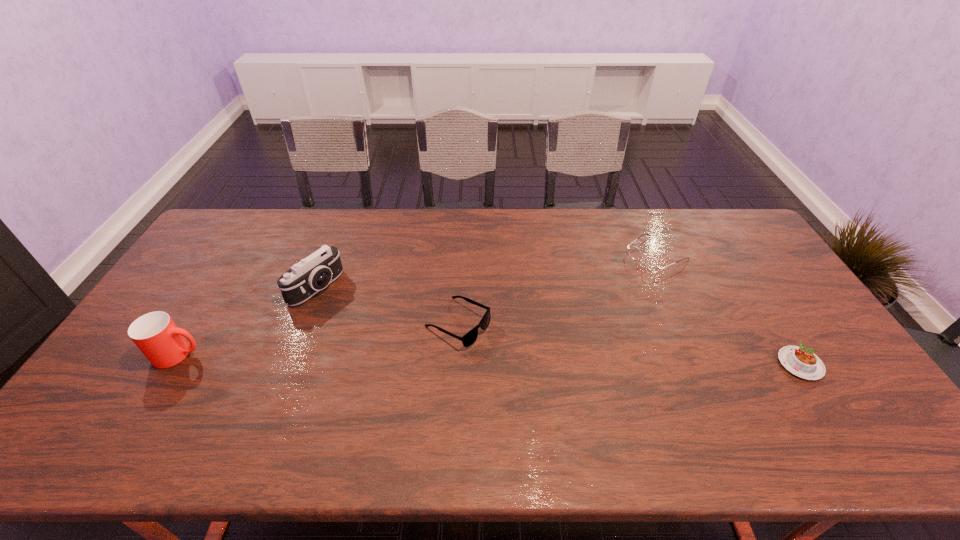
Find the location of a particular element. blank region between the third object from right to left and the camera is located at coordinates (387, 306).

You are a GUI agent. You are given a task and a screenshot of the screen. Output one action in this format:
    pyautogui.click(x=<x>, y=<y>)
    Task: Click on the vacant space that is in between the fourth object from right to left and the leftmost object
    This screenshot has width=960, height=540.
    Given the screenshot: What is the action you would take?
    pyautogui.click(x=248, y=321)

At what (x,y) coordinates should I click in order to perform the action: click on empty location between the second object from left to right and the spectacles. Please return your answer as a coordinate pair (x, y). Image resolution: width=960 pixels, height=540 pixels. Looking at the image, I should click on (487, 271).

You are a GUI agent. You are given a task and a screenshot of the screen. Output one action in this format:
    pyautogui.click(x=<x>, y=<y>)
    Task: Click on the empty space that is in between the third object from left to right and the pudding
    The height and width of the screenshot is (540, 960).
    Given the screenshot: What is the action you would take?
    pyautogui.click(x=629, y=344)

Where is `vacant space in between the pudding and the sunglasses`? vacant space in between the pudding and the sunglasses is located at coordinates (629, 344).

You are a GUI agent. You are given a task and a screenshot of the screen. Output one action in this format:
    pyautogui.click(x=<x>, y=<y>)
    Task: Click on the second closest object to the second object from right to left
    
    Given the screenshot: What is the action you would take?
    pyautogui.click(x=468, y=339)

Find the location of a particular element. object that is the third nearest to the camera is located at coordinates (651, 263).